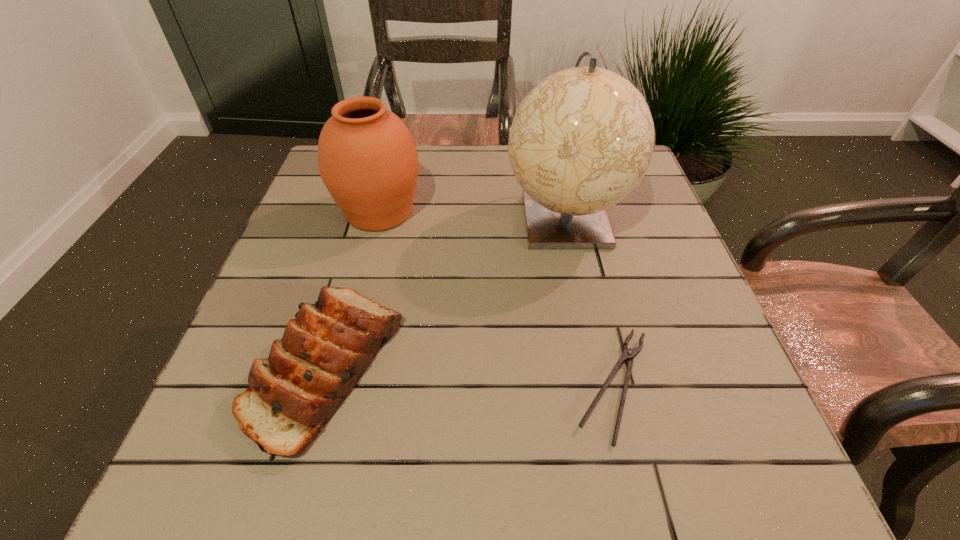
In the image, there is a desktop. Identify the location of vacant space at the far edge. The height and width of the screenshot is (540, 960). tap(433, 153).

Identify the location of blank area at the near edge. (516, 498).

In the image, there is a desktop. Where is `free region at the left edge`? free region at the left edge is located at coordinates (296, 230).

In the image, there is a desktop. At what (x,y) coordinates should I click in order to perform the action: click on vacant space at the right edge. Please return your answer as a coordinate pair (x, y). The height and width of the screenshot is (540, 960). Looking at the image, I should click on (609, 249).

Find the location of `free space at the near left corner of the desktop`. free space at the near left corner of the desktop is located at coordinates (223, 468).

The image size is (960, 540). Find the location of `vacant space that's between the bread and the globe`. vacant space that's between the bread and the globe is located at coordinates (446, 293).

The image size is (960, 540). In order to click on empty space that is in between the third shortest object and the tallest object in this screenshot , I will do `click(472, 215)`.

The width and height of the screenshot is (960, 540). Find the location of `free space between the shortest object and the tallest object`. free space between the shortest object and the tallest object is located at coordinates (589, 302).

At what (x,y) coordinates should I click in order to perform the action: click on blank region between the tongs and the second shortest object. Please return your answer as a coordinate pair (x, y). Image resolution: width=960 pixels, height=540 pixels. Looking at the image, I should click on (470, 376).

Identify the location of free space that is in between the bread and the tongs. The height and width of the screenshot is (540, 960). (470, 376).